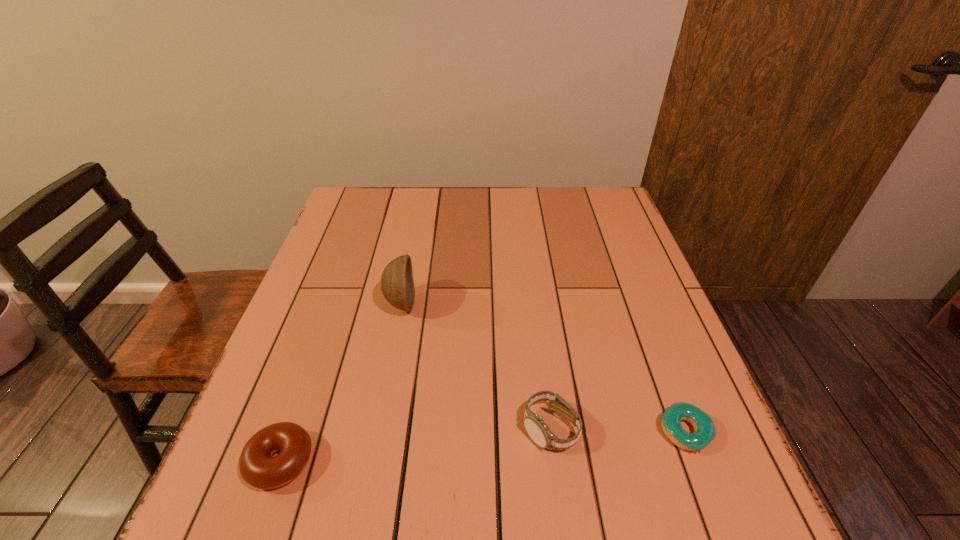
Where is `free space between the second object from right to left and the right doughnut`? free space between the second object from right to left and the right doughnut is located at coordinates (617, 430).

At what (x,y) coordinates should I click in order to perform the action: click on vacant region between the farthest object and the third tallest object. Please return your answer as a coordinate pair (x, y). Looking at the image, I should click on (341, 382).

Where is `object that stands as the second closest to the farthest object`? object that stands as the second closest to the farthest object is located at coordinates (534, 424).

The width and height of the screenshot is (960, 540). Find the location of `object that stands as the second closest to the third object from left to right`. object that stands as the second closest to the third object from left to right is located at coordinates (397, 285).

I want to click on free space that satisfies the following two spatial constraints: 1. on the back side of the farthest object; 2. on the left side of the leftmost object, so click(336, 303).

Where is `blank space that satisfies the following two spatial constraints: 1. on the face of the shortest object; 2. on the right side of the third object from left to right`? The width and height of the screenshot is (960, 540). blank space that satisfies the following two spatial constraints: 1. on the face of the shortest object; 2. on the right side of the third object from left to right is located at coordinates (550, 432).